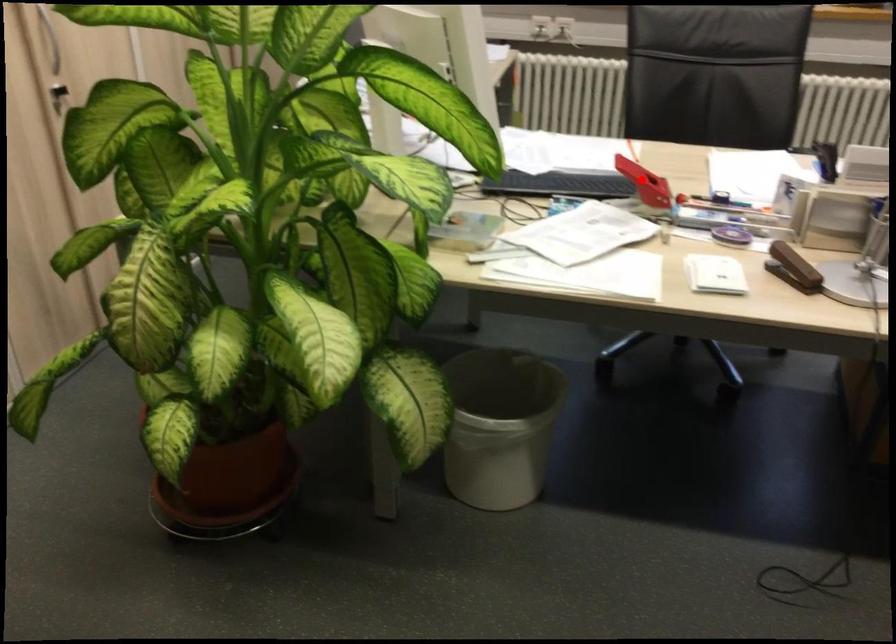
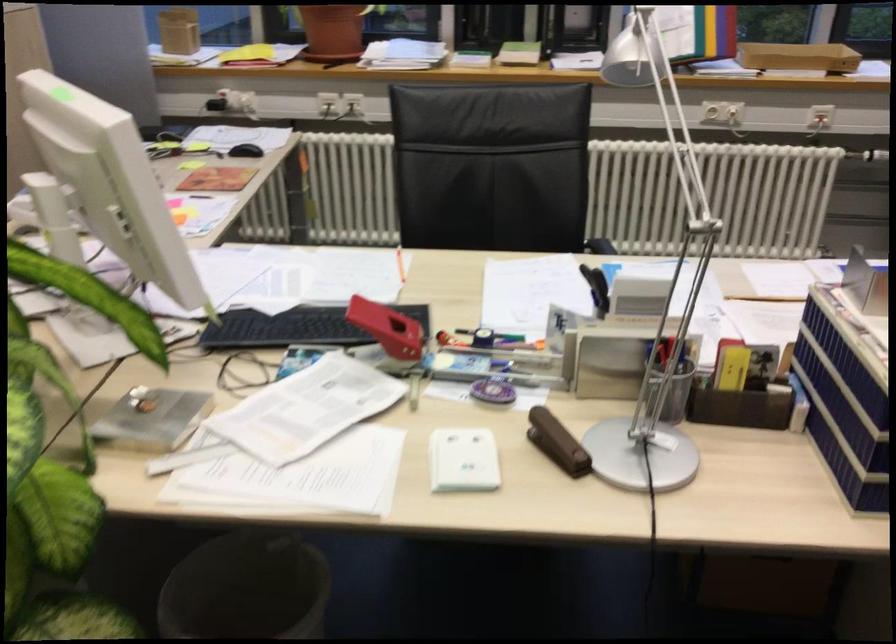
Question: I am providing you with two images of the same scene from different viewpoints. Image1 has a red point marked. In image2, the corresponding 3D location appears at what relative position? Reply with the corresponding letter.

Choices:
 (A) Closer
 (B) Farther

Answer: (A)